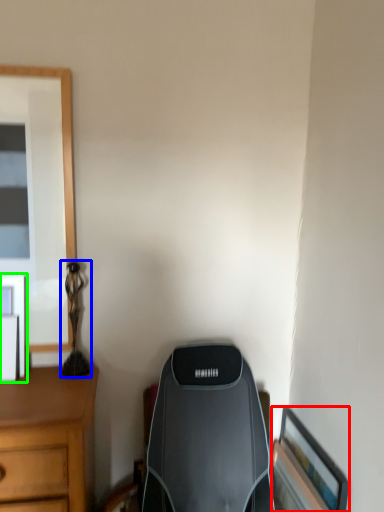
Question: Which is farther away from picture frame (highlighted by a red box)? table lamp (highlighted by a blue box) or picture frame (highlighted by a green box)?

Choices:
 (A) table lamp
 (B) picture frame

Answer: (B)